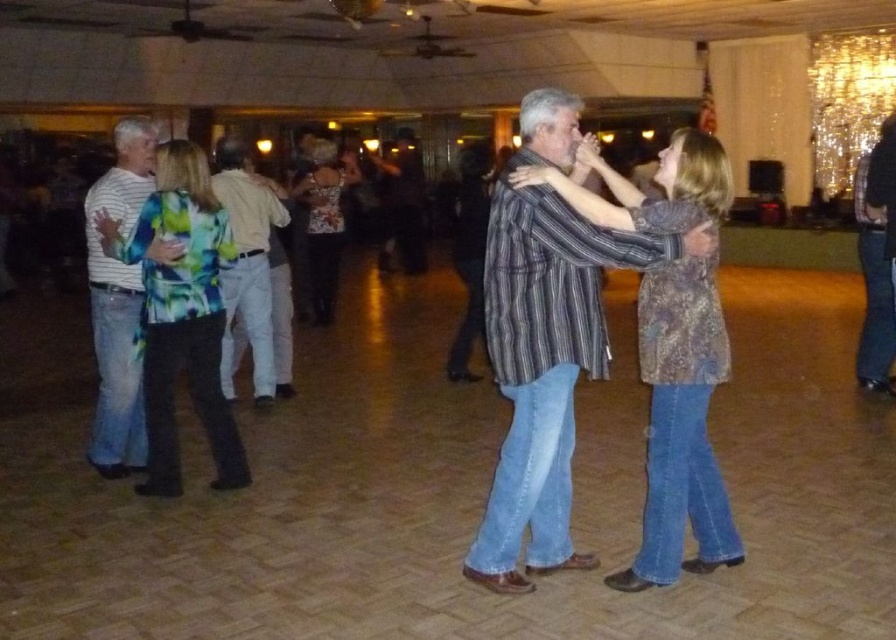
You are at a dance hall and see two people dancing. The man is wearing a striped cotton shirt at left, and the woman is wearing a printed silk blouse at center. Which one is more to the left?

The striped cotton shirt at left is more to the left than the printed silk blouse at center.